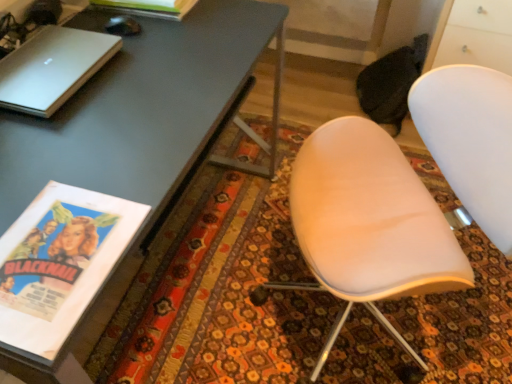
At what (x,y) coordinates should I click in order to perform the action: click on blank space to the left of black glossy mouse at upper left. Please return your answer as a coordinate pair (x, y). This screenshot has height=384, width=512. Looking at the image, I should click on [x=84, y=23].